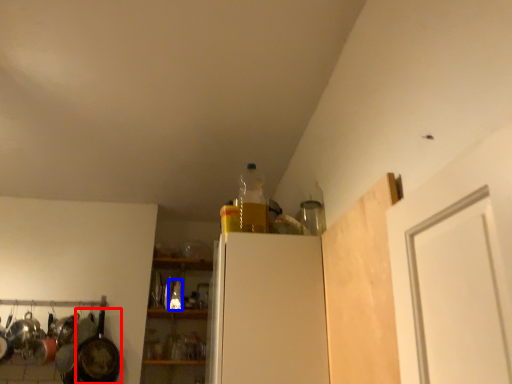
Question: Which of the following is the farthest to the observer, frying pan (highlighted by a red box) or bottle (highlighted by a blue box)?

Choices:
 (A) frying pan
 (B) bottle

Answer: (B)